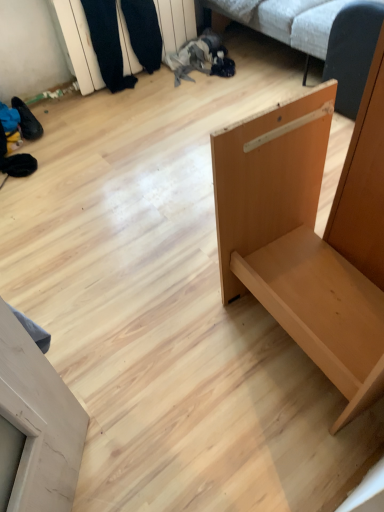
The height and width of the screenshot is (512, 384). I want to click on vacant area in front of wooden shelf at upper left, so click(141, 114).